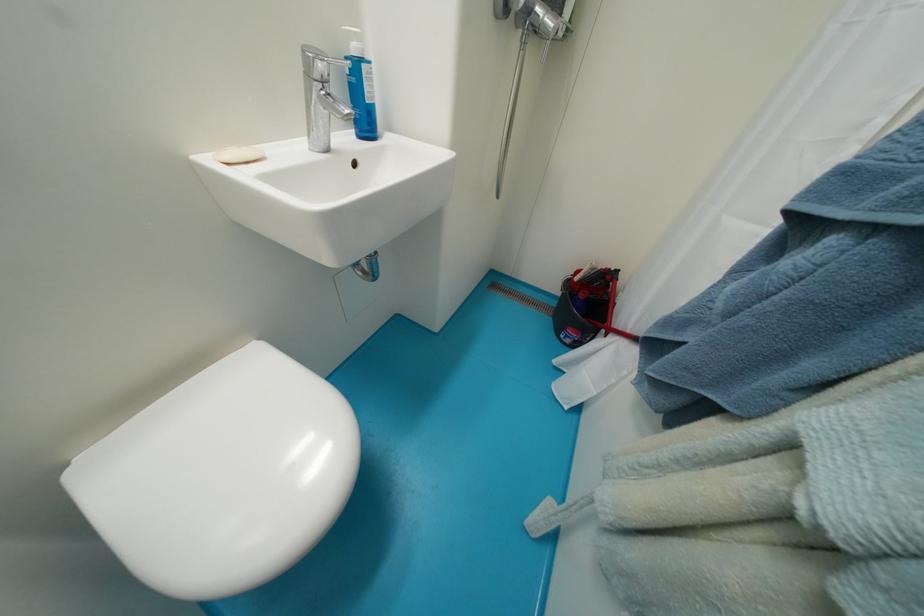
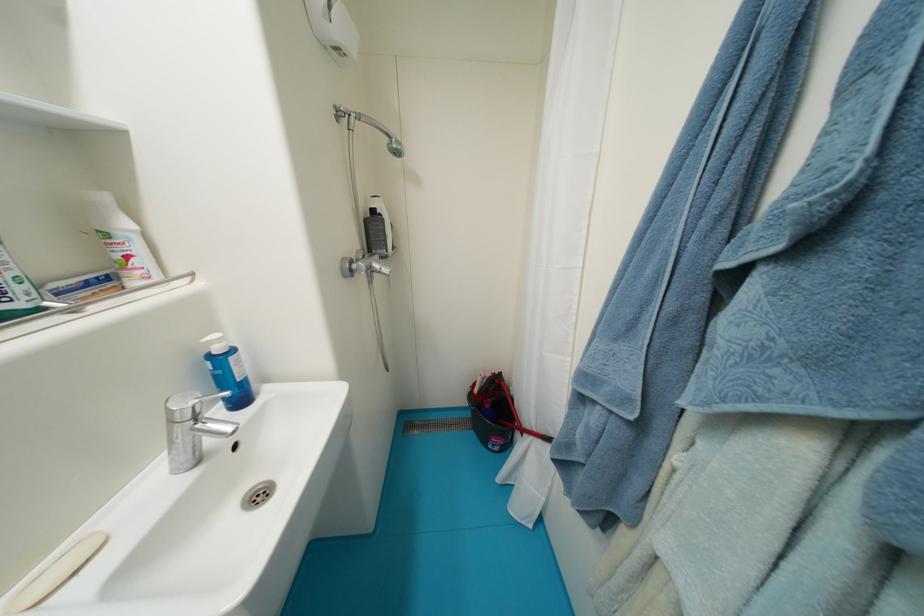
Find the pixel in the second image that matches point 556,321 in the first image.

(479, 435)